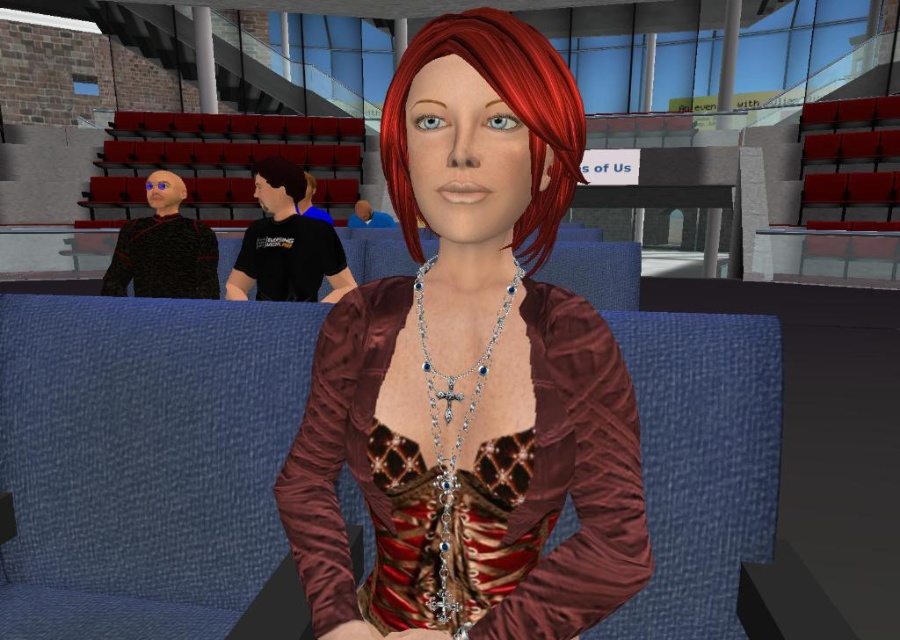
Question: Does silver/glassy rosary at center have a lesser width compared to brown matte hair at center?

Choices:
 (A) no
 (B) yes

Answer: (B)

Question: Observing the image, what is the correct spatial positioning of shiny brown dress at center in reference to brown matte hair at center?

Choices:
 (A) left
 (B) right

Answer: (B)

Question: Among these points, which one is nearest to the camera?

Choices:
 (A) (460, 376)
 (B) (270, 161)
 (C) (555, 93)

Answer: (C)

Question: Among these points, which one is farthest from the camera?

Choices:
 (A) (274, 177)
 (B) (531, 65)
 (C) (459, 486)

Answer: (A)

Question: Among these objects, which one is farthest from the camera?

Choices:
 (A) shiny brown dress at center
 (B) silver/glassy rosary at center
 (C) shiny red hair at center

Answer: (B)

Question: Can you confirm if shiny red hair at center is bigger than silver/glassy rosary at center?

Choices:
 (A) no
 (B) yes

Answer: (B)